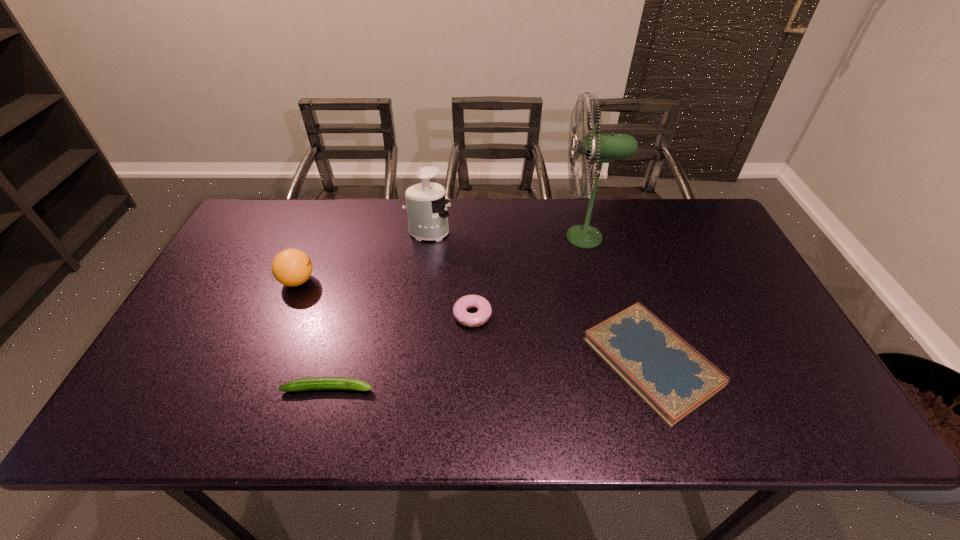
Image resolution: width=960 pixels, height=540 pixels. Find the location of `vacant region located 0.320m on the front-facing side of the tallest object`. vacant region located 0.320m on the front-facing side of the tallest object is located at coordinates (457, 237).

Locate an element on the screen. This screenshot has width=960, height=540. vacant space situated 0.140m on the back of the fifth shortest object is located at coordinates tap(433, 199).

At what (x,y) coordinates should I click in order to perform the action: click on free space located on the side with brand of the fourth nearest object. Please return your answer as a coordinate pair (x, y). Looking at the image, I should click on (432, 281).

Identify the location of vacant region located on the front of the doughnut. (470, 413).

At what (x,y) coordinates should I click in order to perform the action: click on free spot located 0.090m on the back of the paperback book. Please return your answer as a coordinate pair (x, y). The width and height of the screenshot is (960, 540). Looking at the image, I should click on (626, 284).

Where is `free space located 0.050m on the front-facing side of the fifth object from right to left`? free space located 0.050m on the front-facing side of the fifth object from right to left is located at coordinates (396, 388).

At what (x,y) coordinates should I click in order to perform the action: click on fan that is at the far edge. Please return your answer as a coordinate pair (x, y). The height and width of the screenshot is (540, 960). Looking at the image, I should click on (600, 148).

Find the location of `juicer that is at the far edge`. juicer that is at the far edge is located at coordinates (427, 213).

Where is `object that is at the near edge`? This screenshot has height=540, width=960. object that is at the near edge is located at coordinates (673, 378).

In the image, there is a desktop. Where is `vacant space at the far edge`? This screenshot has width=960, height=540. vacant space at the far edge is located at coordinates (660, 232).